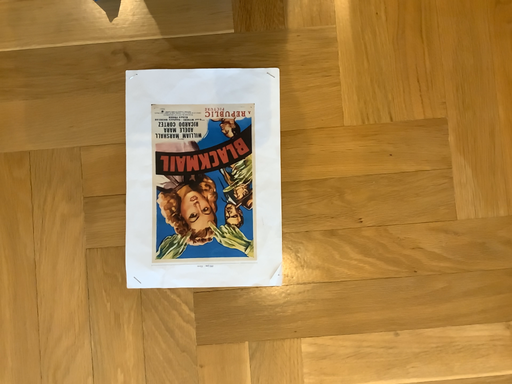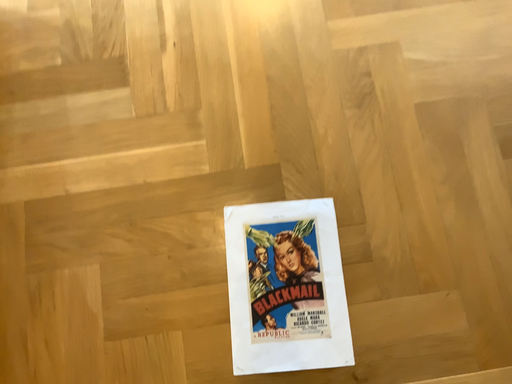
Question: Which way did the camera rotate in the video?

Choices:
 (A) rotated upward
 (B) rotated downward

Answer: (A)